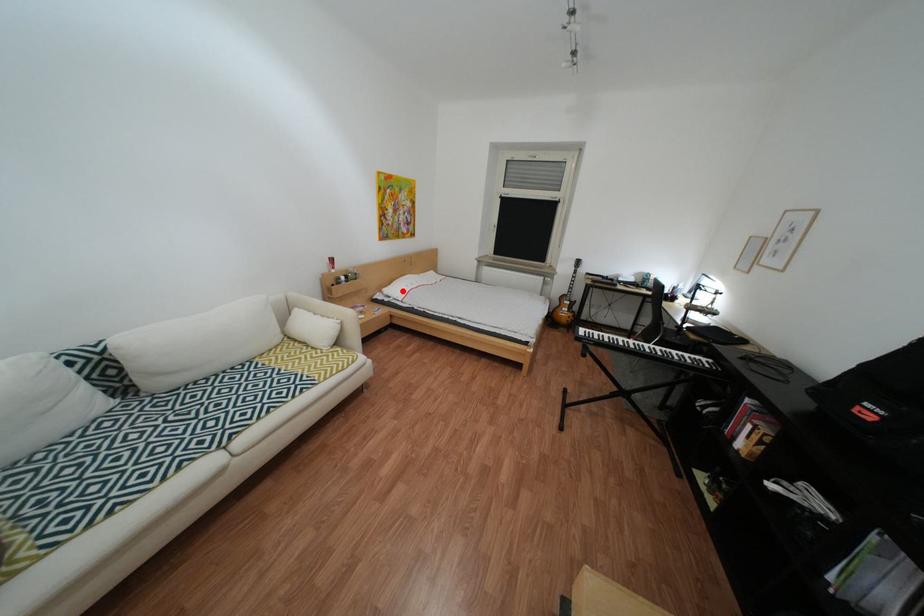
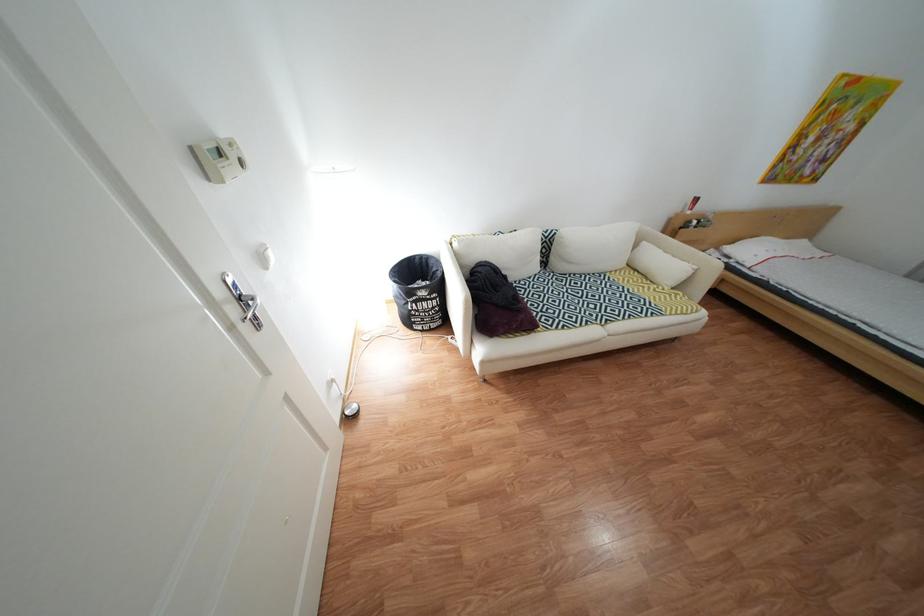
Question: I am providing you with two images of the same scene from different viewpoints. In image1, a red point is highlighted. Considering the same 3D point in image2, which of the following is correct?

Choices:
 (A) It is closer
 (B) It is farther

Answer: (B)